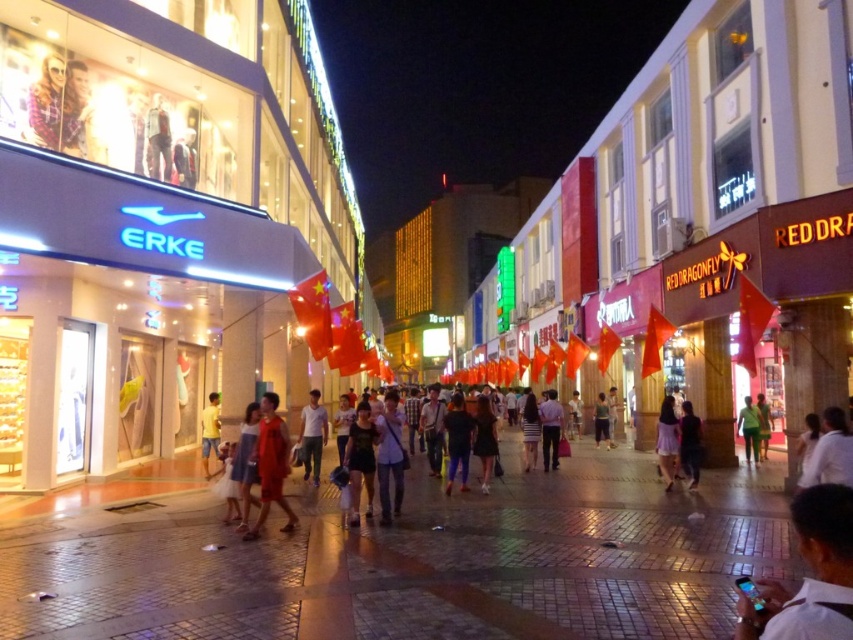
At what (x,y) coordinates should I click in order to perform the action: click on white shirt at center. Please return your answer as a coordinate pair (x, y). The width and height of the screenshot is (853, 640). Looking at the image, I should click on (830, 452).

Between white shirt at center and green fabric pants at center, which one is positioned lower?

green fabric pants at center

Who is more distant from viewer, (836,477) or (749,426)?

The point (749,426) is more distant.

Where is `white shirt at center`? The width and height of the screenshot is (853, 640). white shirt at center is located at coordinates (830, 452).

Does dark blue jeans at center have a larger size compared to yellow cotton shorts at center?

No, dark blue jeans at center is not bigger than yellow cotton shorts at center.

Which is more to the left, dark blue jeans at center or yellow cotton shorts at center?

yellow cotton shorts at center is more to the left.

Locate an element on the screen. dark blue jeans at center is located at coordinates (689, 444).

Between point (767, 600) and point (740, 419), which one is positioned behind?

The point (740, 419) is behind.

What are the coordinates of `white shirt at lower right` in the screenshot? It's located at (811, 572).

Where is `white shirt at lower right`? white shirt at lower right is located at coordinates (811, 572).